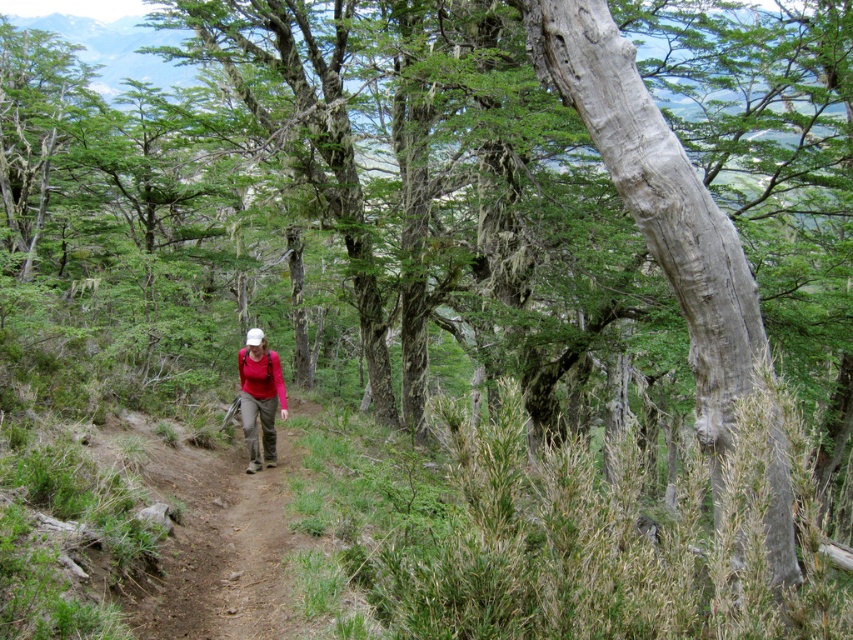
Question: In this image, where is brown dirt trail at center located relative to matte red shirt at center?

Choices:
 (A) right
 (B) left

Answer: (B)

Question: Which of the following is the closest to the observer?

Choices:
 (A) brown dirt trail at center
 (B) matte red shirt at center

Answer: (A)

Question: Among these points, which one is nearest to the camera?

Choices:
 (A) (260, 522)
 (B) (268, 456)

Answer: (A)

Question: Does brown dirt trail at center have a smaller size compared to matte red shirt at center?

Choices:
 (A) no
 (B) yes

Answer: (A)

Question: Which point is closer to the camera taking this photo?

Choices:
 (A) (163, 614)
 (B) (270, 424)

Answer: (A)

Question: Where is brown dirt trail at center located in relation to matte red shirt at center in the image?

Choices:
 (A) above
 (B) below

Answer: (B)